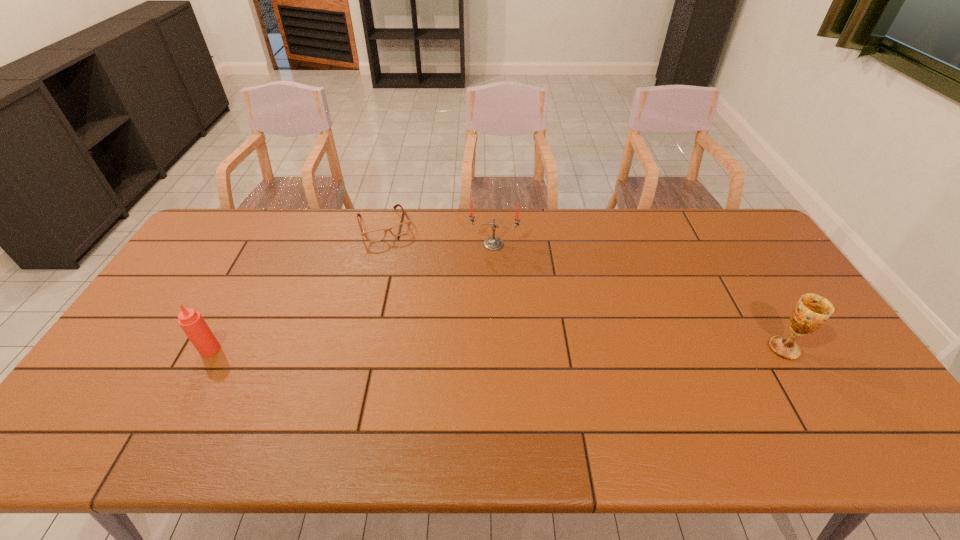
Where is `Tabasco sauce`? Tabasco sauce is located at coordinates (192, 323).

Locate an element on the screen. The height and width of the screenshot is (540, 960). chalice is located at coordinates (812, 311).

The image size is (960, 540). I want to click on candle, so click(493, 243).

The image size is (960, 540). Identify the location of spectacles. (400, 229).

Where is `the third object from right to left`? This screenshot has height=540, width=960. the third object from right to left is located at coordinates (400, 229).

Locate an element on the screen. This screenshot has width=960, height=540. free space located 0.230m on the back of the Tabasco sauce is located at coordinates (246, 282).

This screenshot has width=960, height=540. Find the location of `free location located 0.150m on the back of the rightmost object`. free location located 0.150m on the back of the rightmost object is located at coordinates (753, 298).

Locate an element on the screen. The image size is (960, 540). vacant space located on the front-facing side of the candle is located at coordinates (478, 338).

In order to click on free space located on the front-facing side of the candle in this screenshot , I will do `click(480, 326)`.

I want to click on free region located 0.400m on the front-facing side of the candle, so click(x=477, y=346).